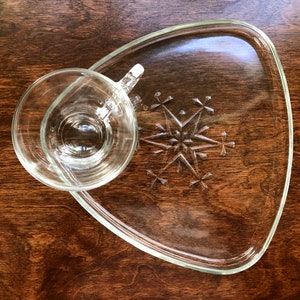
Identify the location of rim of mug. The image size is (300, 300). (54, 73).